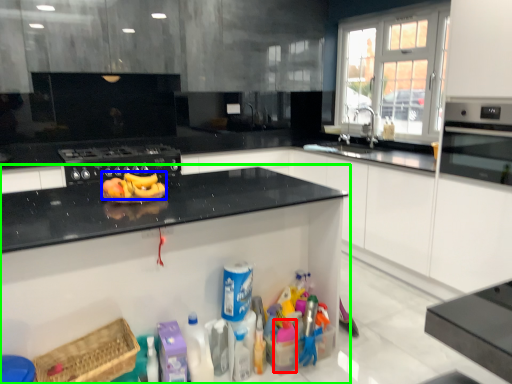
Question: Which object is the closest to the cleaning product (highlighted by a red box)? Choose among these: banana (highlighted by a blue box) or cabinetry (highlighted by a green box).

Choices:
 (A) banana
 (B) cabinetry

Answer: (B)